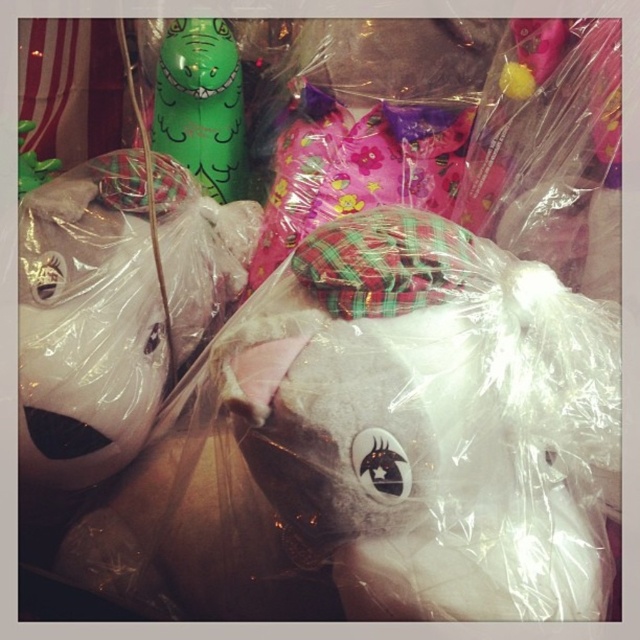
You are a store employee who needs to arrange these items for a display. The store has a rule that items must be placed at least 10 inches apart for safety. Can you place the white plush unicorn at lower left and the green rubber toy at upper left closer together without violating the rule?

The distance between the white plush unicorn at lower left and the green rubber toy at upper left is currently 9.48 inches. Since the required minimum distance is 10 inches, moving them closer would violate the rule. To comply, they need to be moved further apart to meet or exceed the 10 inch separation requirement.

You are standing in front of a display of wrapped items and see two points marked on the image. Which point, point (19, 397) or point (220, 164), is closer to you?

Point (19, 397) is closer to the viewer than point (220, 164).